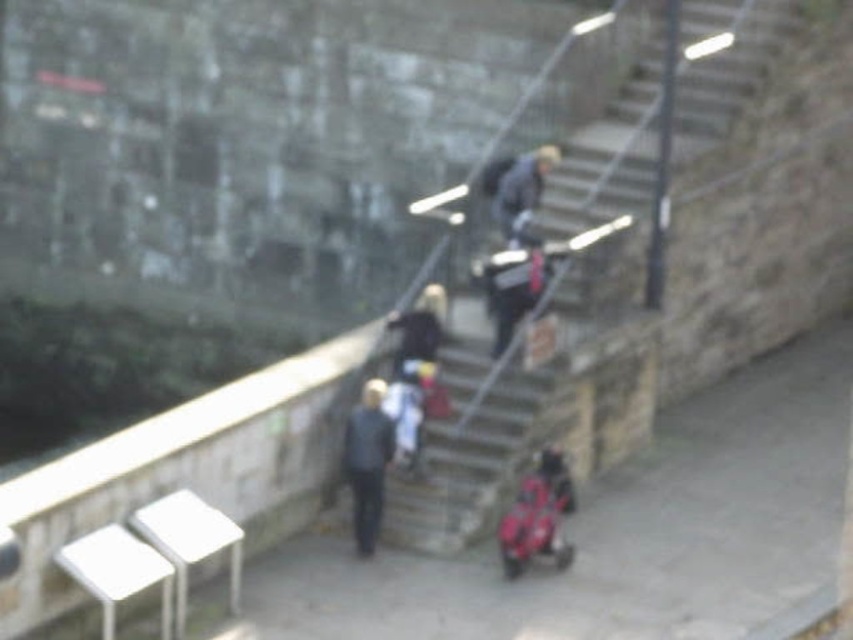
This screenshot has width=853, height=640. What do you see at coordinates (521, 186) in the screenshot?
I see `dark gray jacket at upper center` at bounding box center [521, 186].

Between point (514, 188) and point (416, 356), which one is positioned behind?

Positioned behind is point (514, 188).

Locate an element on the screen. This screenshot has height=640, width=853. dark gray jacket at upper center is located at coordinates (521, 186).

Which of these two, dark blue jacket at center or dark gray jacket at upper center, stands shorter?

Standing shorter between the two is dark gray jacket at upper center.

Which is in front, point (381, 488) or point (538, 179)?

Point (381, 488) is in front.

Locate an element on the screen. Image resolution: width=853 pixels, height=640 pixels. dark blue jacket at center is located at coordinates (367, 461).

Between dark blue jacket at upper center and dark gray jacket at upper center, which one has less height?

Standing shorter between the two is dark gray jacket at upper center.

Who is lower down, dark blue jacket at upper center or dark gray jacket at upper center?

dark blue jacket at upper center

Locate an element on the screen. dark blue jacket at upper center is located at coordinates (515, 285).

This screenshot has height=640, width=853. Find the location of `dark blue jacket at upper center`. dark blue jacket at upper center is located at coordinates (515, 285).